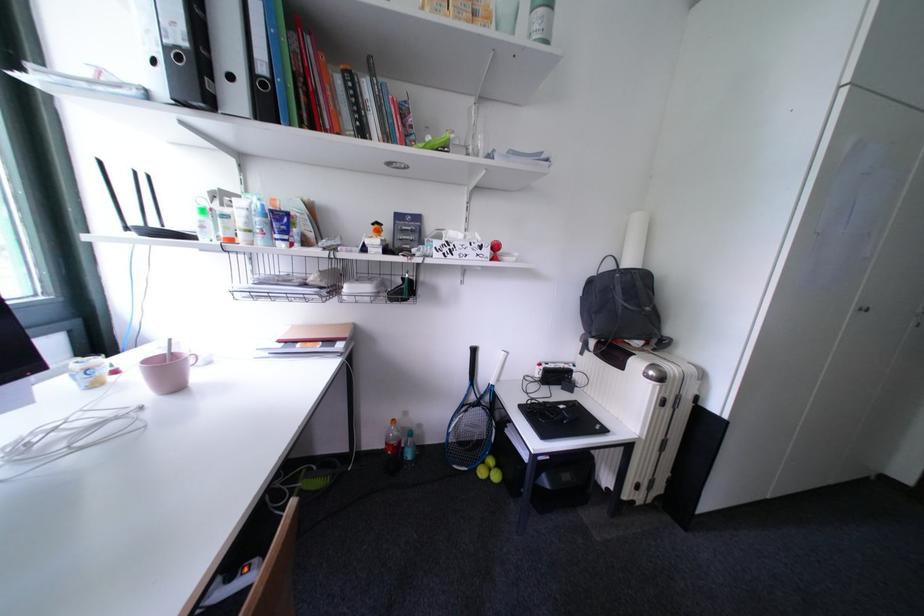
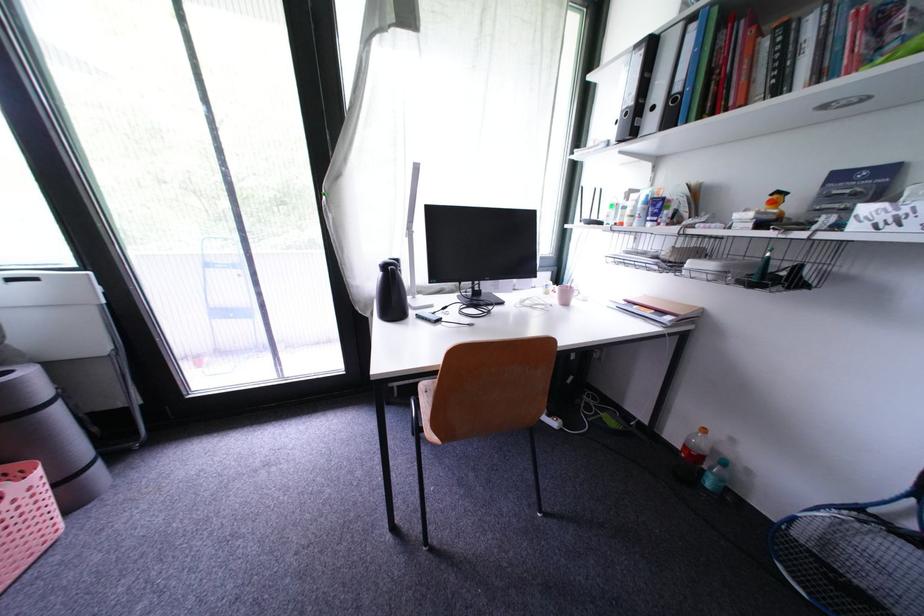
The point at (199, 363) is marked in the first image. Where is the corresponding point in the second image?

(584, 296)